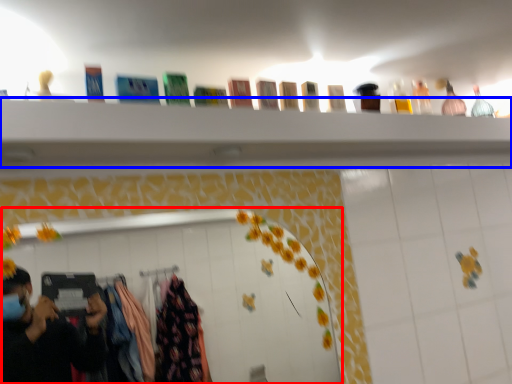
Question: Which point is closer to the camera, mirror (highlighted by a red box) or closet (highlighted by a blue box)?

Choices:
 (A) mirror
 (B) closet

Answer: (B)